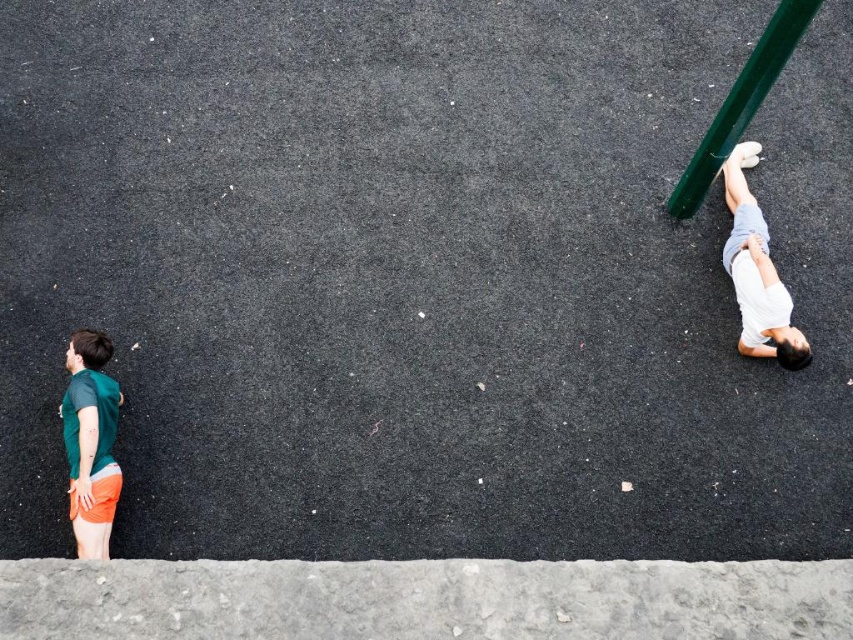
You are a photographer trying to capture a photo of the white cotton shorts at right and the green metallic pole at upper right. You want to ensure both are clearly visible in the frame. Based on their sizes, which object should you focus on first to ensure proper focus?

The white cotton shorts at right are narrower than the green metallic pole at upper right, so you should focus on the green metallic pole at upper right first since it is wider and more prominent in the frame.

Consider the image. What object is located at the coordinates point (90, 442)?

The point (90, 442) corresponds to the green matte shorts at left.

You are a photographer positioned at the center of the asphalt surface. You want to take a photo that includes both the green matte shorts at left and the white cotton shorts at right. Which direction should you move to ensure both are in the frame?

Since the green matte shorts at left is to the left of white cotton shorts at right, you should move to the center between them to include both in the frame.